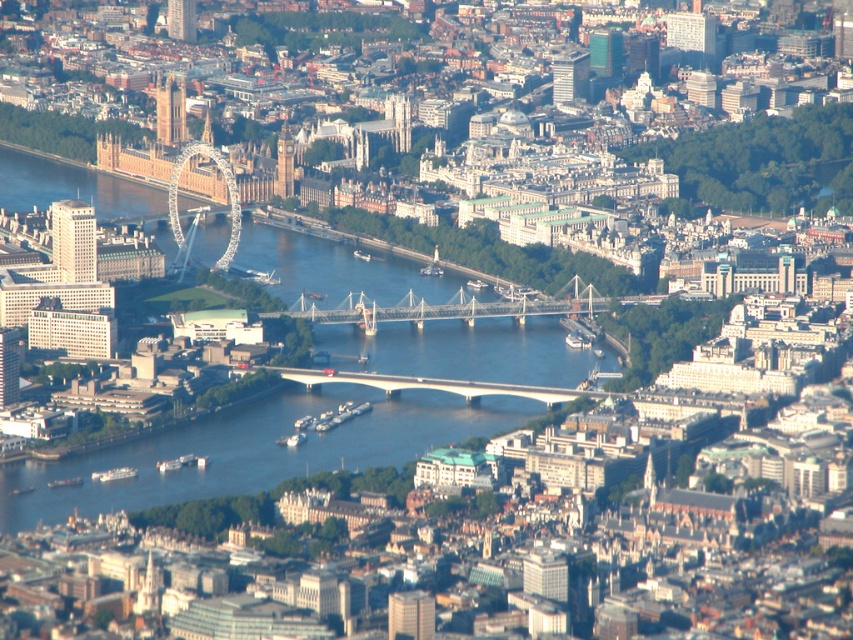
Question: Does blue water at center lie behind white concrete bridge at center?

Choices:
 (A) yes
 (B) no

Answer: (B)

Question: Which point appears closest to the camera in this image?

Choices:
 (A) [233, 211]
 (B) [317, 339]

Answer: (B)

Question: Can you confirm if blue water at center is positioned to the right of metallic gray bridge at center?

Choices:
 (A) yes
 (B) no

Answer: (B)

Question: Which object appears farthest from the camera in this image?

Choices:
 (A) white concrete bridge at center
 (B) metallic gray bridge at center
 (C) blue water at center
 (D) metallic glass tower bridge at center-left

Answer: (D)

Question: Does blue water at center have a larger size compared to metallic gray bridge at center?

Choices:
 (A) no
 (B) yes

Answer: (B)

Question: Considering the real-world distances, which object is farthest from the metallic glass tower bridge at center-left?

Choices:
 (A) white concrete bridge at center
 (B) metallic gray bridge at center
 (C) blue water at center

Answer: (A)